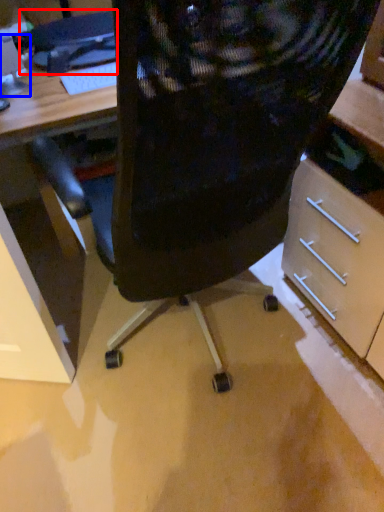
Question: Which point is further to the camera, computer (highlighted by a red box) or computer monitor (highlighted by a blue box)?

Choices:
 (A) computer
 (B) computer monitor

Answer: (A)